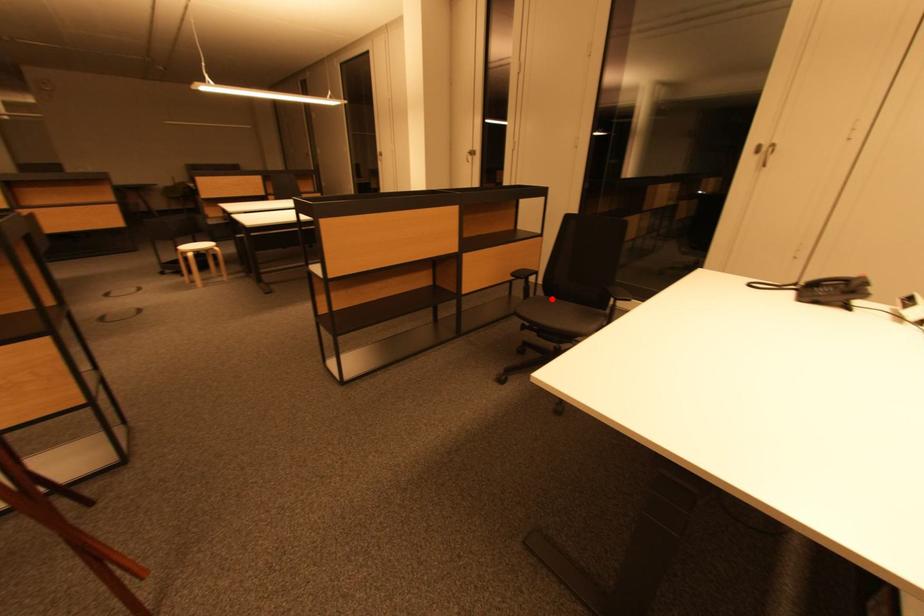
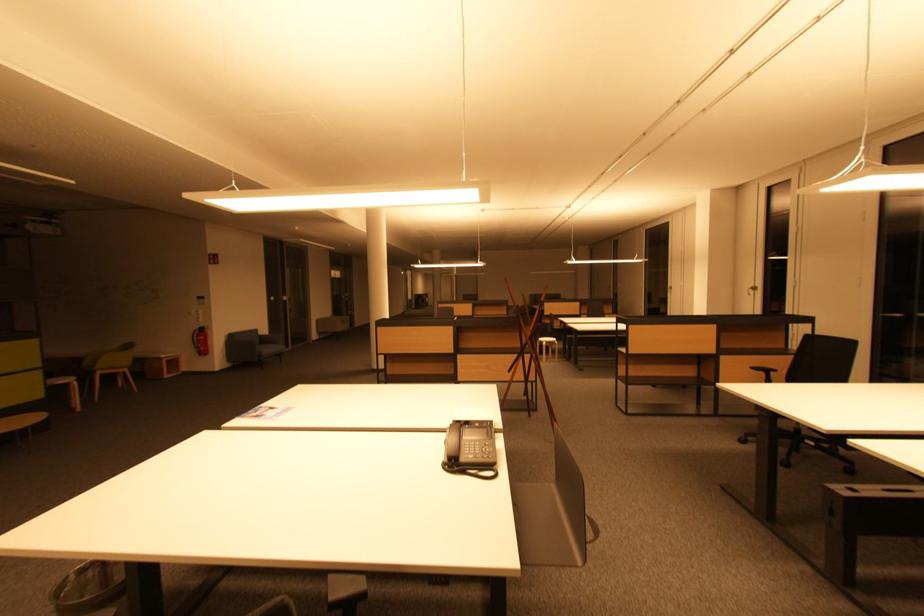
Question: I am providing you with two images of the same scene from different viewpoints. A red point is marked on the first image. Can you still see the location of the red point in image 2?

Choices:
 (A) Yes
 (B) No

Answer: (B)